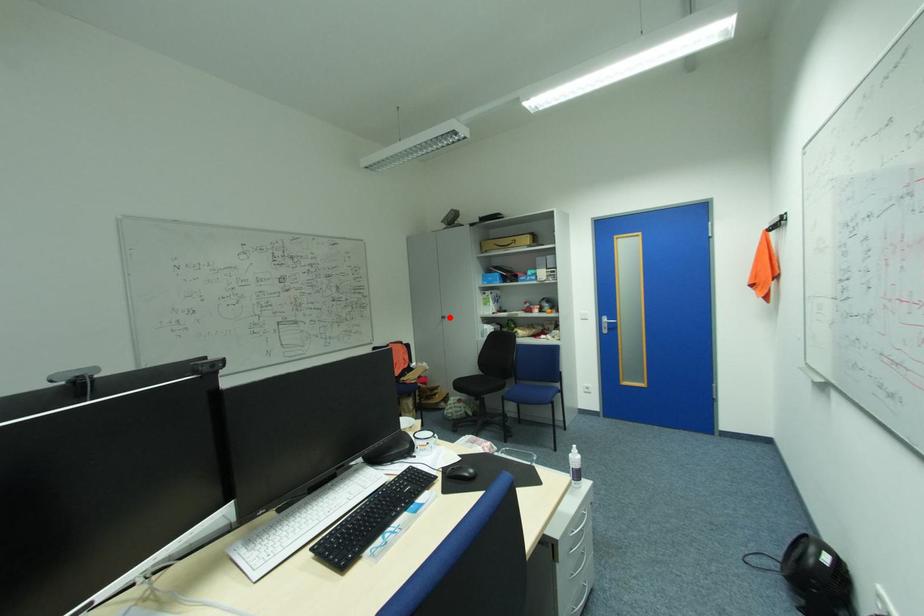
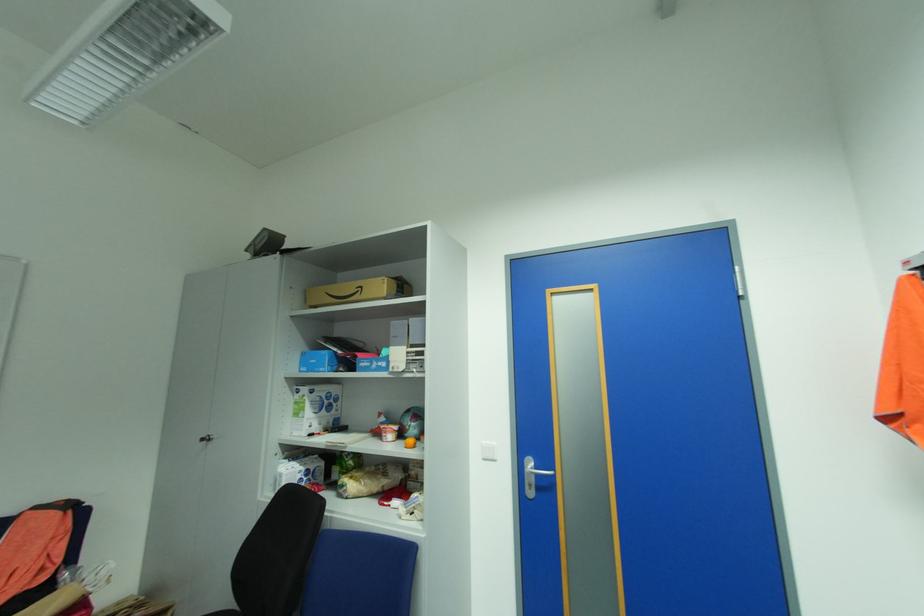
The point at the highlighted location is marked in the first image. Where is the corresponding point in the second image?

(213, 439)